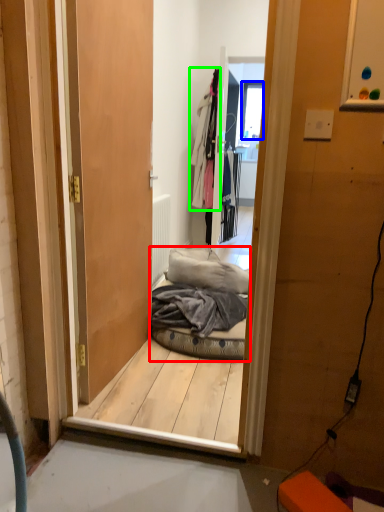
Question: Considering the real-world distances, which object is farthest from bed (highlighted by a red box)? window (highlighted by a blue box) or clothing (highlighted by a green box)?

Choices:
 (A) window
 (B) clothing

Answer: (A)